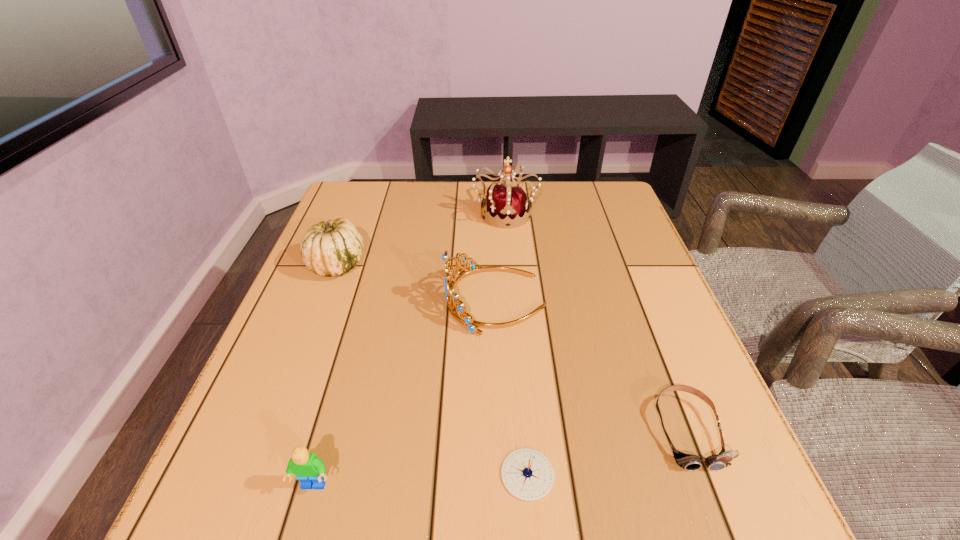
Image resolution: width=960 pixels, height=540 pixels. Find the location of `blank area in the image that satisfies the following two spatial constraints: 1. on the front-facing side of the farthest object; 2. on the front-facing side of the nearer tiara`. blank area in the image that satisfies the following two spatial constraints: 1. on the front-facing side of the farthest object; 2. on the front-facing side of the nearer tiara is located at coordinates (512, 300).